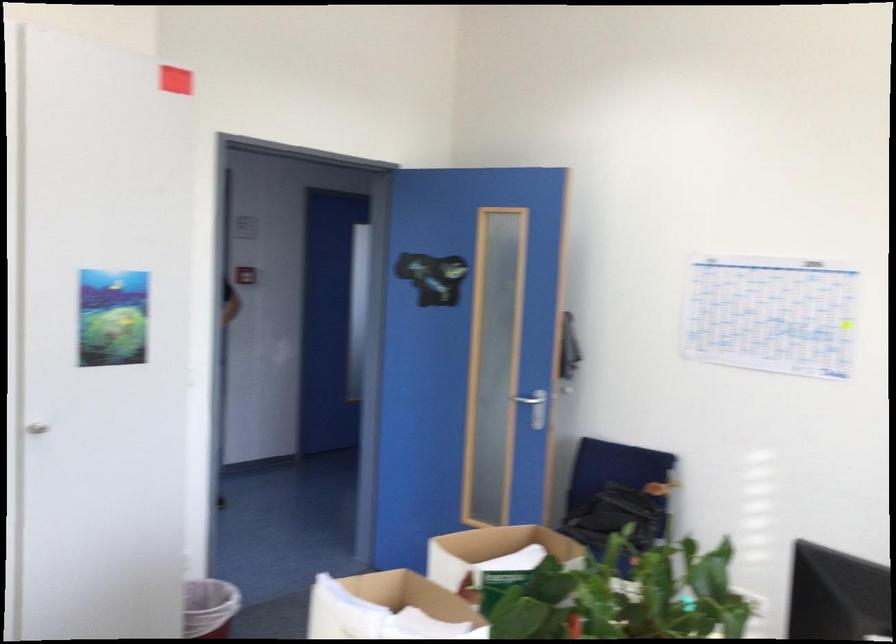
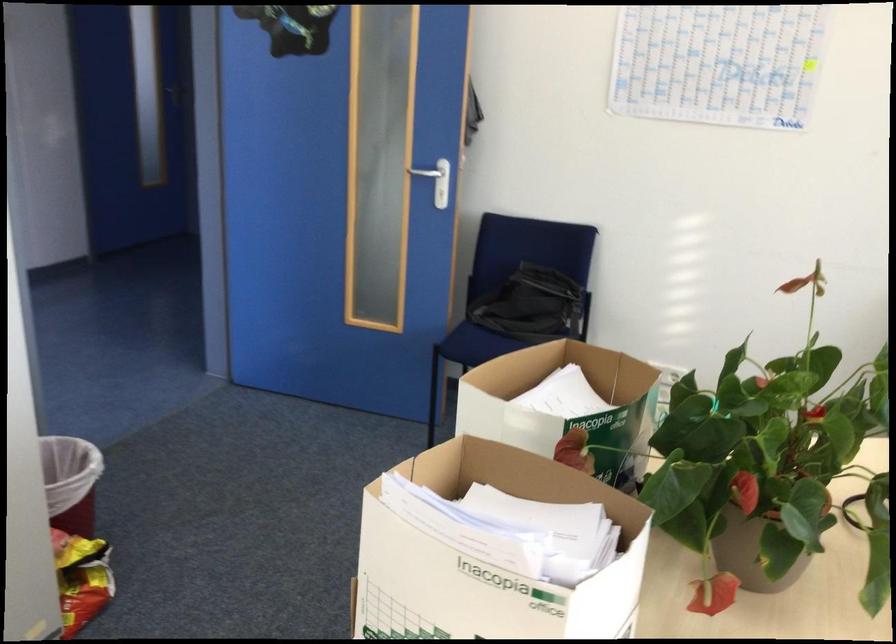
The point at (521, 381) is marked in the first image. Where is the corresponding point in the second image?

(424, 172)